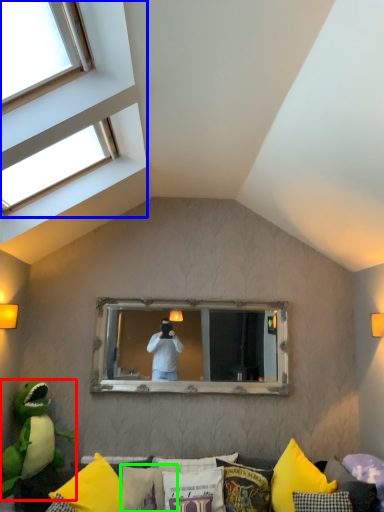
Question: Which is farther away from parrot (highlighted by a red box)? window (highlighted by a blue box) or pillow (highlighted by a green box)?

Choices:
 (A) window
 (B) pillow

Answer: (A)